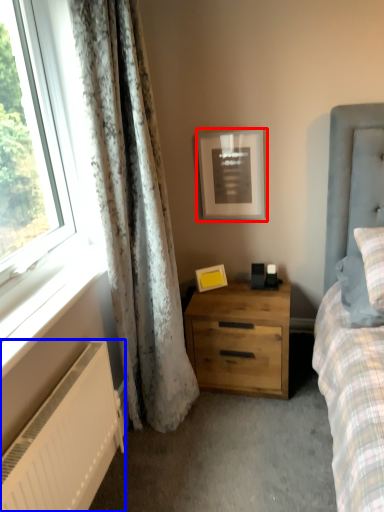
Question: Which of the following is the farthest to the observer, picture frame (highlighted by a red box) or radiator (highlighted by a blue box)?

Choices:
 (A) picture frame
 (B) radiator

Answer: (A)